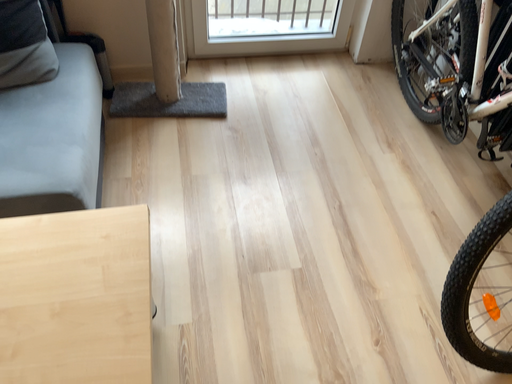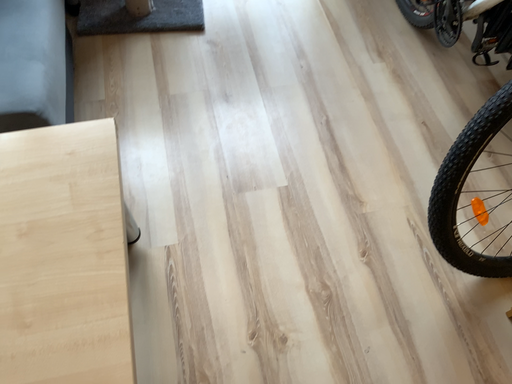
Question: How did the camera likely rotate when shooting the video?

Choices:
 (A) rotated downward
 (B) rotated upward

Answer: (A)